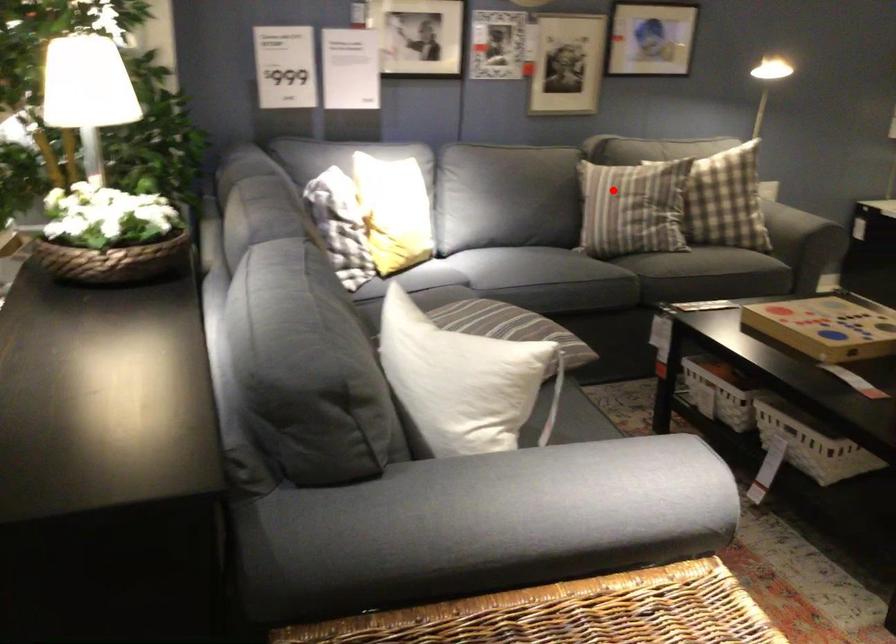
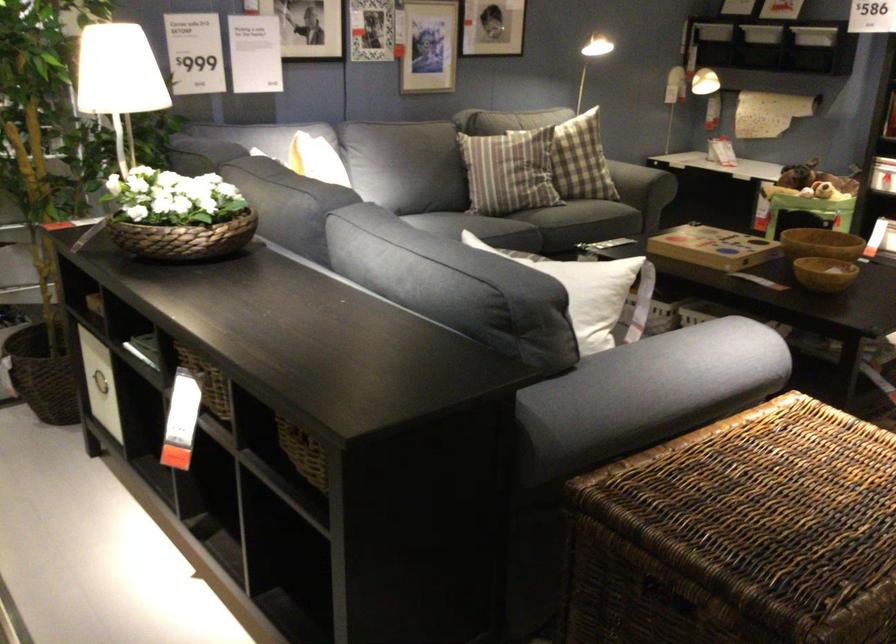
The point at the highlighted location is marked in the first image. Where is the corresponding point in the second image?

(507, 172)